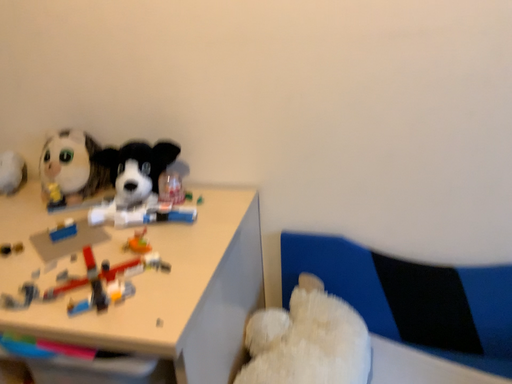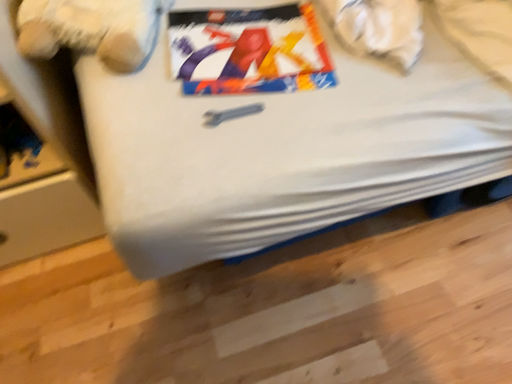
Question: Which way did the camera rotate in the video?

Choices:
 (A) rotated downward
 (B) rotated upward

Answer: (A)